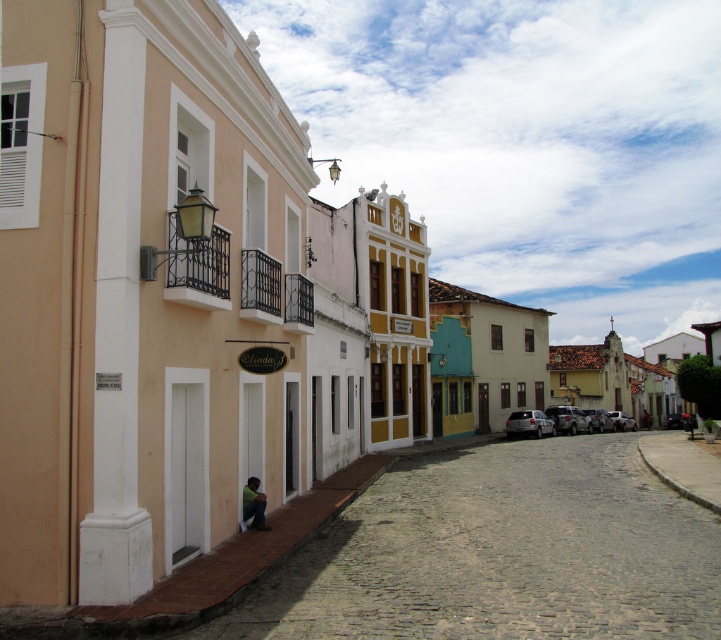
You are a painter who wants to cover the entire surface of the white painted wall at lower left and the dark green fabric at lower center with a new color. If you have enough paint to cover 10 square meters, which object will require more paint?

The white painted wall at lower left requires more paint because it is bigger than the dark green fabric at lower center according to the description.

In the scene shown: You are a painter who wants to create a mural on the white painted wall at lower left and the dark green fabric at lower center. Which surface would require a longer ladder to reach its top?

The white painted wall at lower left is much taller than the dark green fabric at lower center, so you would need a longer ladder for the white painted wall at lower left.